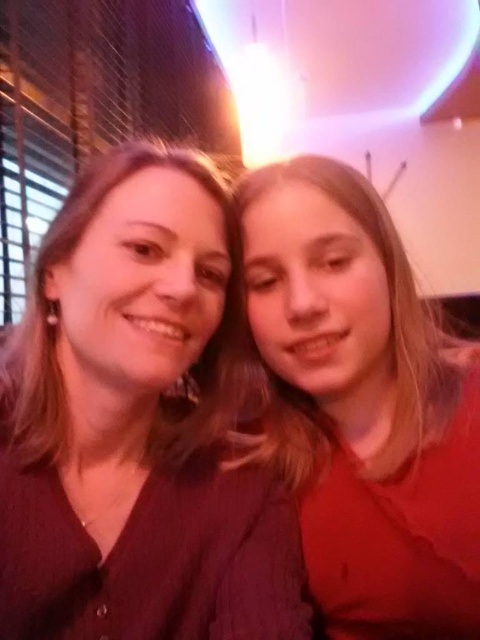
You are taking a photo of two people wearing the matte brown shirt at center and the matte red shirt at right. Which shirt is more visible in the photo?

The matte brown shirt at center is more visible in the photo because it is in front of the matte red shirt at right.

You are trying to decide which shirt to wear for an event. You have a matte brown shirt at center and a matte red shirt at right. If you want to choose the wider one, which shirt should you pick?

The matte brown shirt at center is wider than the matte red shirt at right, so you should pick the matte brown shirt at center.

You are a photographer trying to capture a group photo of two people wearing the matte brown shirt at center and the matte red shirt at right. The camera you are using has a minimum focusing distance of 14 centimeters. Can you take a clear photo of both shirts at the same time without moving them?

The matte brown shirt at center and matte red shirt at right are 14.18 centimeters apart. Since the distance between them is slightly more than the camera minimum focusing distance of 14 centimeters, the photographer can take a clear photo of both shirts at the same time without moving them.